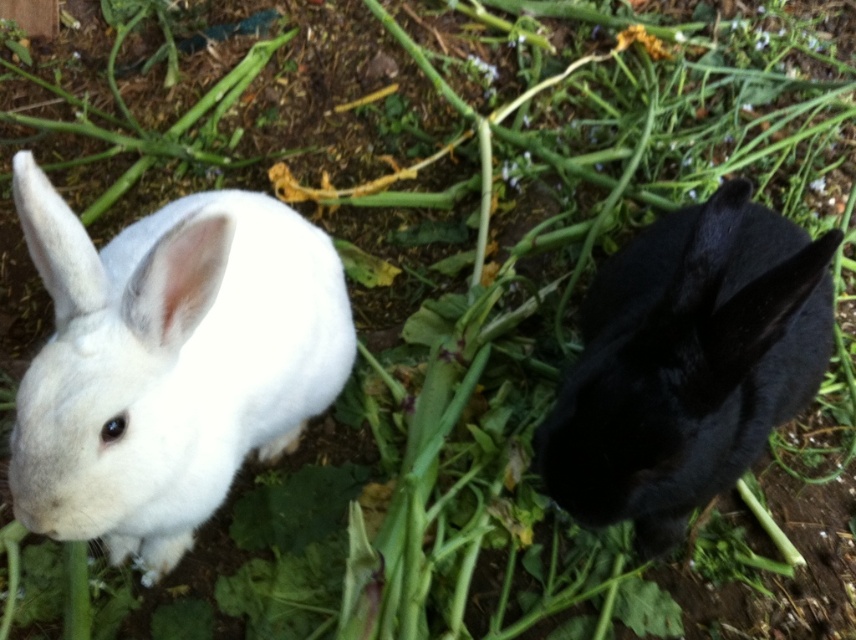
Question: Is white fluffy rabbit at left above black matte rabbit at right?

Choices:
 (A) yes
 (B) no

Answer: (B)

Question: Does white fluffy rabbit at left appear on the left side of black matte rabbit at right?

Choices:
 (A) no
 (B) yes

Answer: (B)

Question: Which point is farther to the camera?

Choices:
 (A) (81, 336)
 (B) (669, 461)

Answer: (B)

Question: Which point appears farthest from the camera in this image?

Choices:
 (A) (673, 332)
 (B) (278, 422)

Answer: (B)

Question: Is white fluffy rabbit at left smaller than black matte rabbit at right?

Choices:
 (A) no
 (B) yes

Answer: (B)

Question: Which object is closer to the camera taking this photo?

Choices:
 (A) white fluffy rabbit at left
 (B) black matte rabbit at right

Answer: (A)